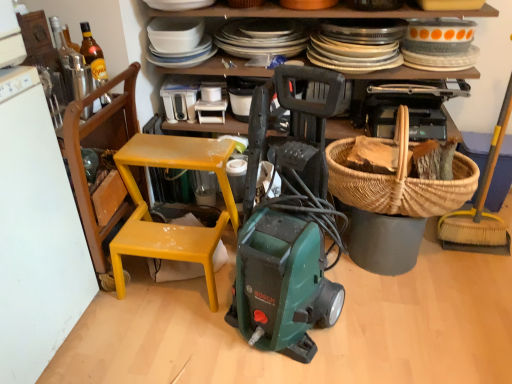
Question: From the image's perspective, is wooden chair at left, acting as the 1th chair starting from the left, above translucent glass bottle at upper left?

Choices:
 (A) no
 (B) yes

Answer: (A)

Question: Is wooden chair at left, acting as the 1th chair starting from the left, oriented away from translucent glass bottle at upper left?

Choices:
 (A) no
 (B) yes

Answer: (A)

Question: Does wooden chair at left, the 2th chair positioned from the right, have a lesser height compared to translucent glass bottle at upper left?

Choices:
 (A) yes
 (B) no

Answer: (B)

Question: From a real-world perspective, does wooden chair at left, acting as the 1th chair starting from the left, sit lower than translucent glass bottle at upper left?

Choices:
 (A) yes
 (B) no

Answer: (A)

Question: Can we say wooden chair at left, acting as the 1th chair starting from the left, lies outside translucent glass bottle at upper left?

Choices:
 (A) yes
 (B) no

Answer: (A)

Question: Is wooden chair at left, acting as the 1th chair starting from the left, closer to camera compared to translucent glass bottle at upper left?

Choices:
 (A) no
 (B) yes

Answer: (B)

Question: Does brown woven picnic basket at center right appear on the right side of white plastic toaster at upper center, placed as the second appliance when sorted from front to back?

Choices:
 (A) no
 (B) yes

Answer: (B)

Question: Is brown woven picnic basket at center right positioned with its back to white plastic toaster at upper center, which is the 2th appliance in left-to-right order?

Choices:
 (A) yes
 (B) no

Answer: (B)

Question: Does brown woven picnic basket at center right have a greater width compared to white plastic toaster at upper center, which is counted as the first appliance, starting from the right?

Choices:
 (A) no
 (B) yes

Answer: (B)

Question: Would you say brown woven picnic basket at center right contains white plastic toaster at upper center, which is counted as the first appliance, starting from the right?

Choices:
 (A) no
 (B) yes

Answer: (A)

Question: Can you confirm if brown woven picnic basket at center right is bigger than white plastic toaster at upper center, placed as the second appliance when sorted from front to back?

Choices:
 (A) no
 (B) yes

Answer: (B)

Question: Is brown woven picnic basket at center right not close to white plastic toaster at upper center, which is counted as the first appliance, starting from the right?

Choices:
 (A) yes
 (B) no

Answer: (B)

Question: Could you tell me if yellow plastic chair at left, marked as the second chair in a left-to-right arrangement, is turned towards brown woven picnic basket at center right?

Choices:
 (A) no
 (B) yes

Answer: (A)